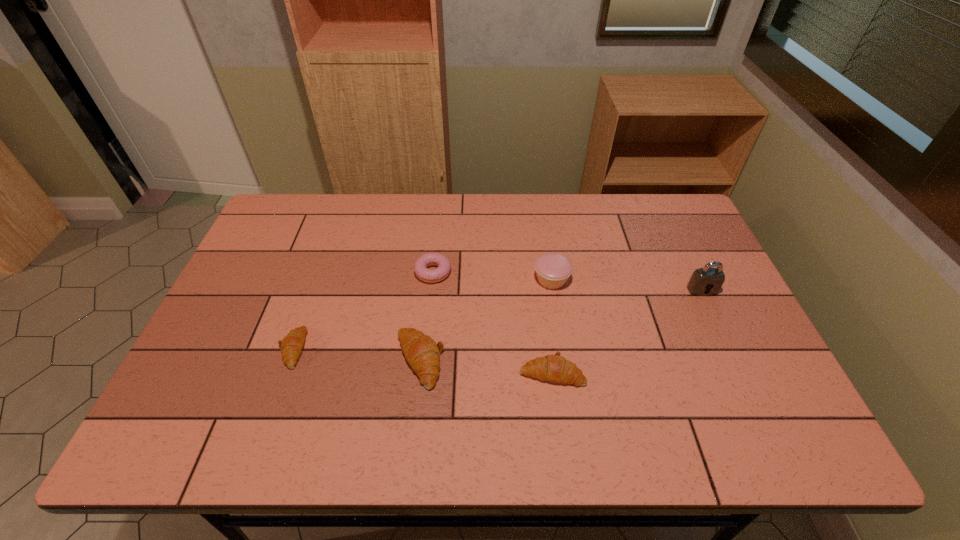
Identify the location of free spot located 0.250m on the back of the second crescent roll from right to left. (430, 266).

Find the location of `vacant area located on the left of the second tallest crescent roll`. vacant area located on the left of the second tallest crescent roll is located at coordinates (446, 373).

Locate an element on the screen. Image resolution: width=960 pixels, height=540 pixels. vacant space situated 0.290m on the front of the cupcake is located at coordinates (567, 383).

You are a GUI agent. You are given a task and a screenshot of the screen. Output one action in this format:
    pyautogui.click(x=<x>, y=<y>)
    Task: Click on the vacant space located at the front of the padlock near the keyhole
    The image size is (960, 540).
    Given the screenshot: What is the action you would take?
    (x=734, y=359)

The image size is (960, 540). Find the location of `free space located on the right of the doughnut`. free space located on the right of the doughnut is located at coordinates (478, 272).

This screenshot has width=960, height=540. In order to click on object that is at the right edge in this screenshot , I will do [702, 280].

This screenshot has width=960, height=540. Identify the location of free region at the far edge. (540, 199).

Where is `free space at the near edge of the desktop`? The image size is (960, 540). free space at the near edge of the desktop is located at coordinates (610, 375).

You are a GUI agent. You are given a task and a screenshot of the screen. Output one action in this format:
    pyautogui.click(x=<x>, y=<y>)
    Task: Click on the vacant area at the left edge of the desktop
    The width and height of the screenshot is (960, 540).
    Given the screenshot: What is the action you would take?
    pyautogui.click(x=239, y=322)

I want to click on vacant area at the right edge of the desktop, so click(710, 321).